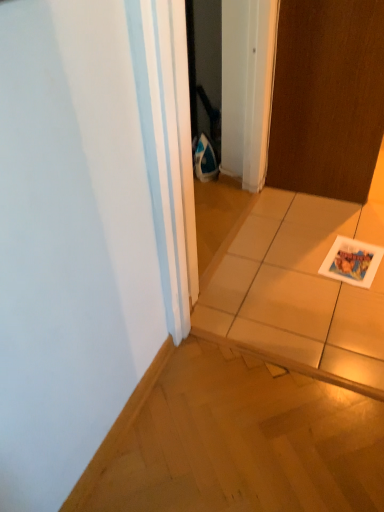
The image size is (384, 512). Describe the element at coordinates (297, 291) in the screenshot. I see `white glossy tile at center` at that location.

This screenshot has width=384, height=512. Find the location of `brown matte door at upper right`. brown matte door at upper right is located at coordinates (327, 98).

What do you see at coordinates (327, 98) in the screenshot? I see `brown matte door at upper right` at bounding box center [327, 98].

Where is `white glossy tile at center`? white glossy tile at center is located at coordinates (297, 291).

What's the angular difference between white glossy tile at center and brown matte door at upper right's facing directions?

They differ by 90.5 degrees in their facing directions.

From a real-world perspective, is white glossy tile at center physically above brown matte door at upper right?

Incorrect, from a real-world perspective, white glossy tile at center is lower than brown matte door at upper right.

Looking at the image, does white glossy tile at center seem bigger or smaller compared to brown matte door at upper right?

Considering their sizes, white glossy tile at center takes up more space than brown matte door at upper right.

Which is more to the left, white glossy tile at center or white glossy postcard at lower right?

white glossy postcard at lower right is more to the left.

From a real-world perspective, which object rests below the other?

white glossy tile at center, from a real-world perspective.

Could you tell me if white glossy tile at center is facing white glossy postcard at lower right?

Yes, white glossy tile at center is facing white glossy postcard at lower right.

Which is behind, point (291, 349) or point (371, 246)?

The point (371, 246) is more distant.

Can you confirm if brown matte door at upper right is taller than white glossy tile at center?

Correct, brown matte door at upper right is much taller as white glossy tile at center.

Considering the points (290, 39) and (225, 272), which point is in front, point (290, 39) or point (225, 272)?

The point (225, 272) is closer to the camera.

Looking at this image, from a real-world perspective, is brown matte door at upper right beneath white glossy tile at center?

No, from a real-world perspective, brown matte door at upper right is not under white glossy tile at center.

Find the location of `door above the white glossy tile at center (from the image's perspective)`. door above the white glossy tile at center (from the image's perspective) is located at coordinates (327, 98).

From the picture: From a real-world perspective, relative to white glossy tile at center, is white glossy postcard at lower right vertically above or below?

From a real-world perspective, white glossy postcard at lower right is physically above white glossy tile at center.

Is white glossy postcard at lower right to the left of white glossy tile at center from the viewer's perspective?

Yes.

From the image's perspective, is white glossy postcard at lower right positioned above or below white glossy tile at center?

Based on their image positions, white glossy postcard at lower right is located beneath white glossy tile at center.

Which of these two, white glossy postcard at lower right or white glossy tile at center, is smaller?

white glossy postcard at lower right.

Find the location of a particular element. Image resolution: width=384 pixels, height=512 pixels. door above the white glossy postcard at lower right (from the image's perspective) is located at coordinates (x=327, y=98).

Which object is thinner, white glossy postcard at lower right or brown matte door at upper right?

brown matte door at upper right is thinner.

Between white glossy postcard at lower right and brown matte door at upper right, which one is positioned behind?

white glossy postcard at lower right is further away from the camera.

Is brown matte door at upper right inside or outside of white glossy postcard at lower right?

brown matte door at upper right is not inside white glossy postcard at lower right, it's outside.

This screenshot has height=512, width=384. Identify the location of postcard on the right of the brown matte door at upper right. (352, 262).

In terms of height, does brown matte door at upper right look taller or shorter compared to white glossy postcard at lower right?

brown matte door at upper right is taller than white glossy postcard at lower right.

Is brown matte door at upper right facing away from white glossy postcard at lower right?

No, brown matte door at upper right is not facing away from white glossy postcard at lower right.

Image resolution: width=384 pixels, height=512 pixels. In order to click on door above the white glossy tile at center (from the image's perspective) in this screenshot , I will do `click(327, 98)`.

You are a GUI agent. You are given a task and a screenshot of the screen. Output one action in this format:
    pyautogui.click(x=<x>, y=<y>)
    Task: Click on the tile in front of the white glossy postcard at lower right
    The height and width of the screenshot is (512, 384).
    Given the screenshot: What is the action you would take?
    pyautogui.click(x=297, y=291)

Based on their spatial positions, is white glossy postcard at lower right or white glossy tile at center further from brown matte door at upper right?

white glossy tile at center is positioned further to the anchor brown matte door at upper right.

Estimate the real-world distances between objects in this image. Which object is further from white glossy postcard at lower right, white glossy tile at center or brown matte door at upper right?

brown matte door at upper right.

From the image, which object appears to be nearer to white glossy postcard at lower right, brown matte door at upper right or white glossy tile at center?

The object closer to white glossy postcard at lower right is white glossy tile at center.

Based on their spatial positions, is brown matte door at upper right or white glossy postcard at lower right closer to white glossy tile at center?

white glossy postcard at lower right lies closer to white glossy tile at center than the other object.

Considering their positions, is white glossy postcard at lower right positioned closer to white glossy tile at center than brown matte door at upper right?

white glossy postcard at lower right is closer to white glossy tile at center.

Based on the photo, looking at the image, which one is located closer to brown matte door at upper right, white glossy tile at center or white glossy postcard at lower right?

The object closer to brown matte door at upper right is white glossy postcard at lower right.

Identify the location of tile between brown matte door at upper right and white glossy postcard at lower right in the vertical direction. The width and height of the screenshot is (384, 512). (297, 291).